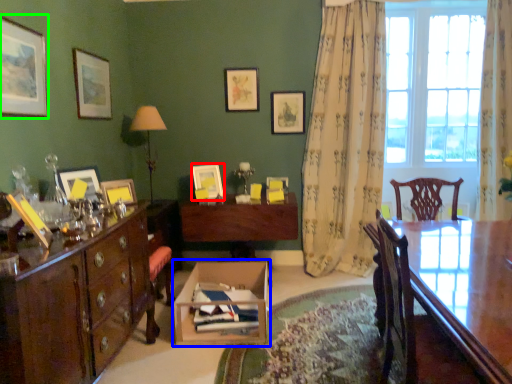
Question: Considering the real-world distances, which object is farthest from picture frame (highlighted by a red box)? cardboard box (highlighted by a blue box) or picture frame (highlighted by a green box)?

Choices:
 (A) cardboard box
 (B) picture frame

Answer: (B)